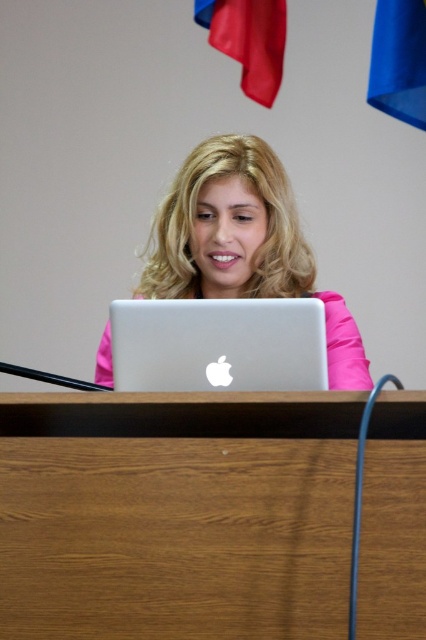
Question: Which point is farther to the camera?

Choices:
 (A) (293, 364)
 (B) (325, 320)

Answer: (B)

Question: Which of the following is the closest to the observer?

Choices:
 (A) (348, 353)
 (B) (161, 572)

Answer: (B)

Question: Which of the following is the closest to the observer?

Choices:
 (A) pink matte laptop at center
 (B) wooden desk at center
 (C) silver metallic laptop at center

Answer: (B)

Question: Can you confirm if wooden desk at center is positioned above silver metallic laptop at center?

Choices:
 (A) yes
 (B) no

Answer: (B)

Question: In this image, where is pink matte laptop at center located relative to silver metallic laptop at center?

Choices:
 (A) left
 (B) right

Answer: (A)

Question: Observing the image, what is the correct spatial positioning of wooden desk at center in reference to pink matte laptop at center?

Choices:
 (A) above
 (B) below

Answer: (B)